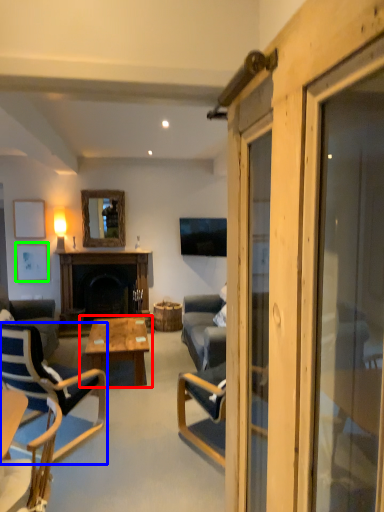
Question: Which is farther away from coffee table (highlighted by a red box)? chair (highlighted by a blue box) or picture frame (highlighted by a green box)?

Choices:
 (A) chair
 (B) picture frame

Answer: (B)